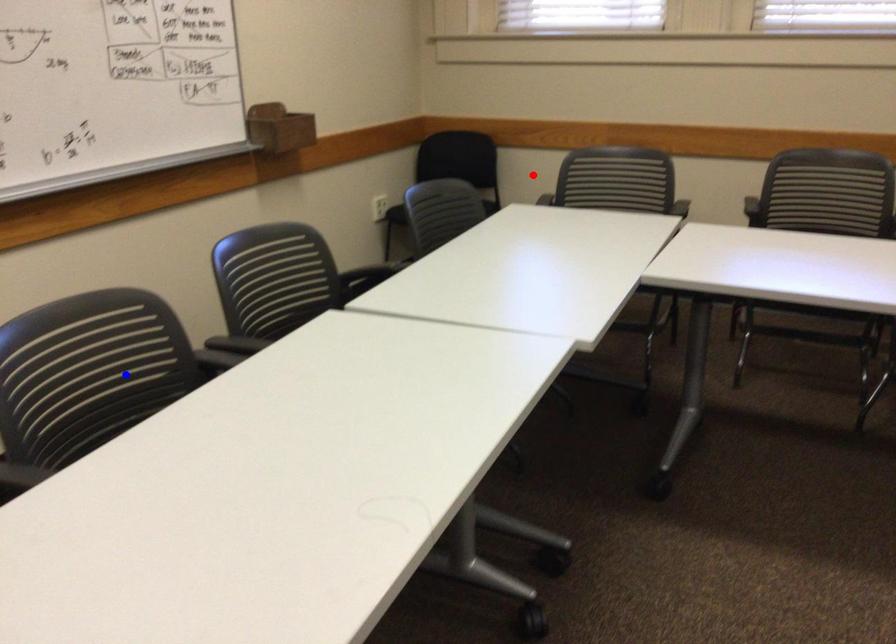
Question: Which of the two points in the image is closer to the camera?

Choices:
 (A) Blue point is closer.
 (B) Red point is closer.

Answer: (A)